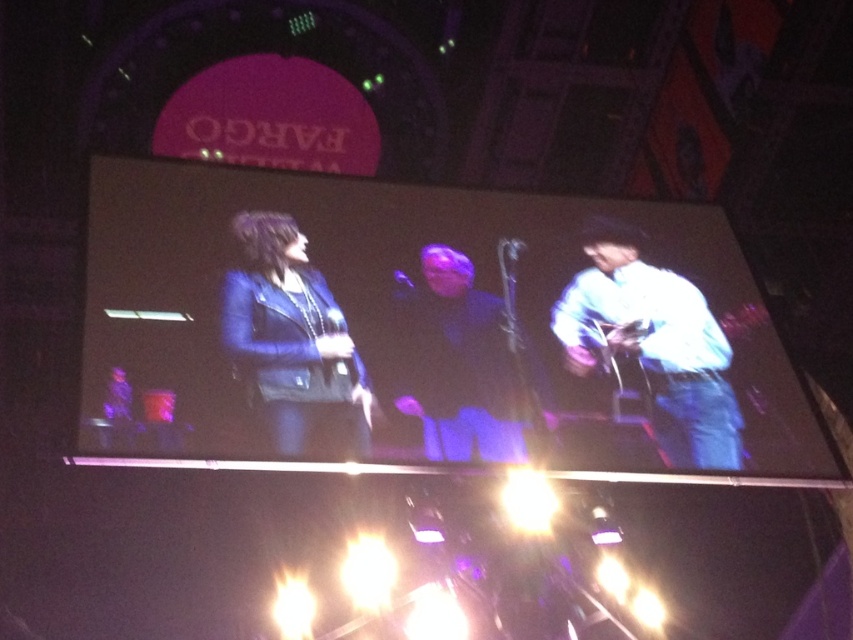
You are a stagehand who needs to adjust the lighting for the performer wearing the white matte shirt at center and the one in dark blue leather jacket at center. The lighting system can only cover a maximum distance of 2 meters between two targets. Will you need to adjust the system to accommodate their positions?

The distance between the white matte shirt at center and the dark blue leather jacket at center is 2.54 meters, which exceeds the 2 meters coverage of the lighting system. Therefore, adjustments are needed to ensure proper lighting for both performers.

You are a photographer in the audience and want to capture a clear photo of both the white matte shirt at center and the dark blue leather jacket at center. Since the stage is dimly lit, you need to ensure both are visible. Which object should you focus on first to ensure proper exposure?

The white matte shirt at center is positioned on the right side of dark blue leather jacket at center, so you should focus on the white matte shirt at center first as it might be better lit due to its position, ensuring proper exposure for both.